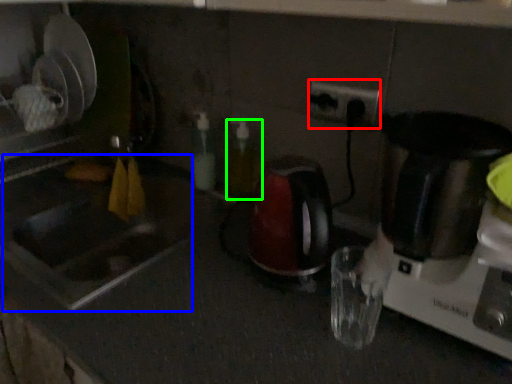
Question: Which object is the closest to the electric outlet (highlighted by a red box)? Choose among these: sink (highlighted by a blue box) or bottle (highlighted by a green box).

Choices:
 (A) sink
 (B) bottle

Answer: (B)